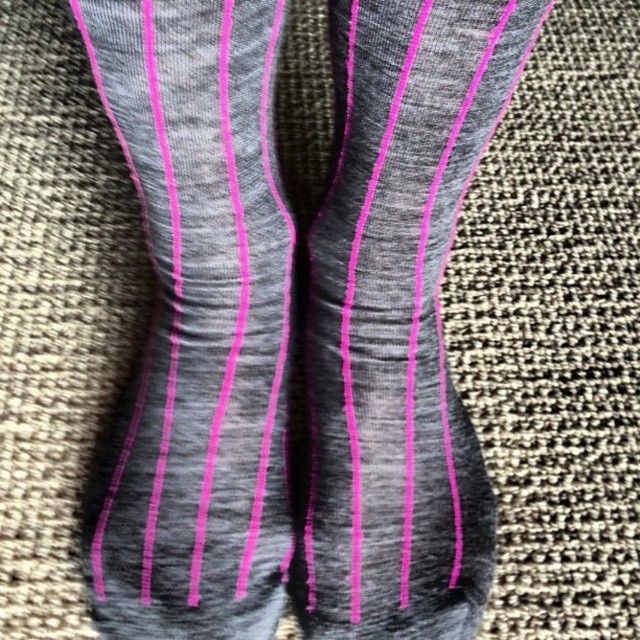
Question: Which point is closer to the camera?

Choices:
 (A) (388, 515)
 (B) (243, 280)

Answer: (A)

Question: Is gray heathered sock at center below matte gray sock at center?

Choices:
 (A) no
 (B) yes

Answer: (A)

Question: Is gray heathered sock at center to the right of matte gray sock at center from the viewer's perspective?

Choices:
 (A) yes
 (B) no

Answer: (B)

Question: Does gray heathered sock at center lie behind matte gray sock at center?

Choices:
 (A) yes
 (B) no

Answer: (B)

Question: Which point is farther to the camera?

Choices:
 (A) matte gray sock at center
 (B) gray heathered sock at center

Answer: (A)

Question: Which point is farther from the camera taking this photo?

Choices:
 (A) (333, 6)
 (B) (257, 192)

Answer: (B)